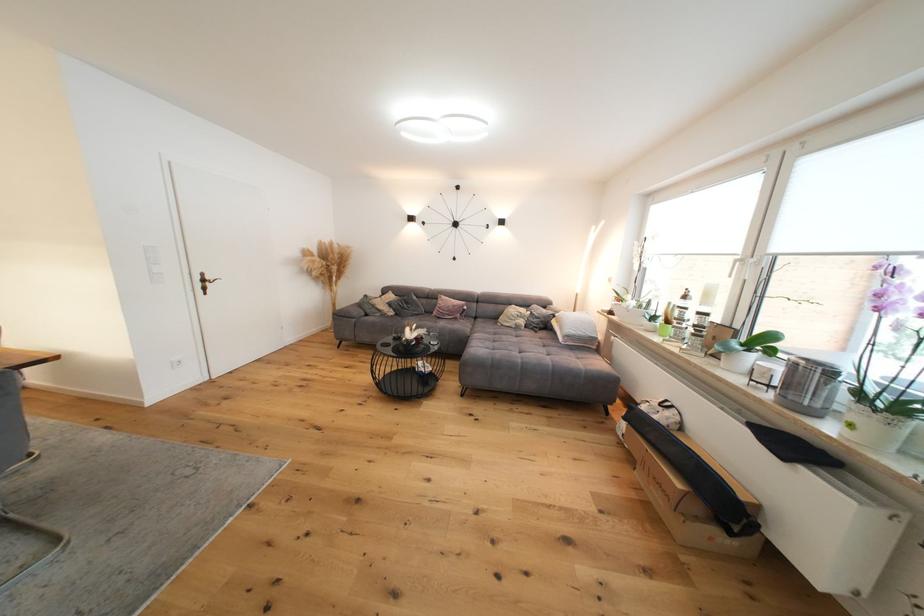
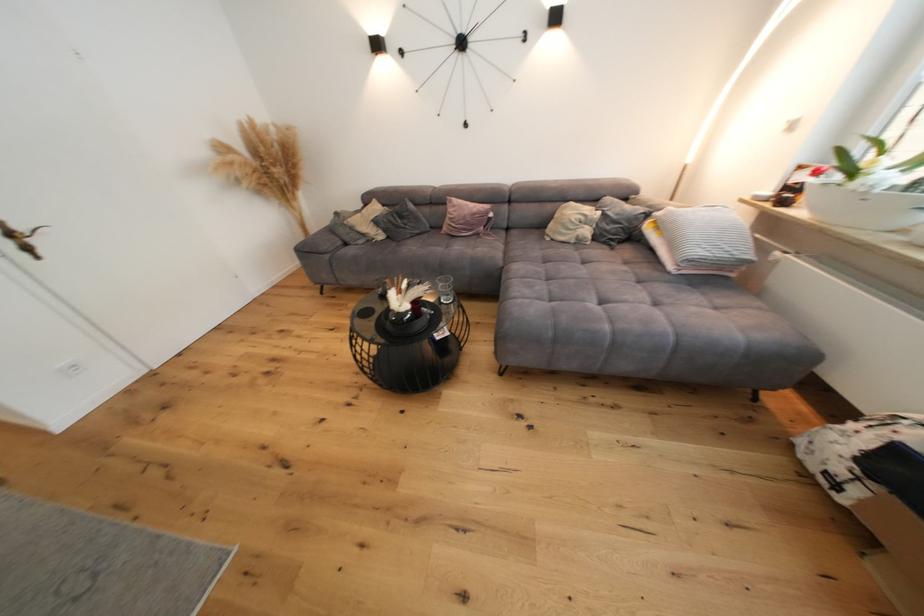
Locate, in the second image, the point that corresponds to point (501, 342) in the first image.

(553, 282)